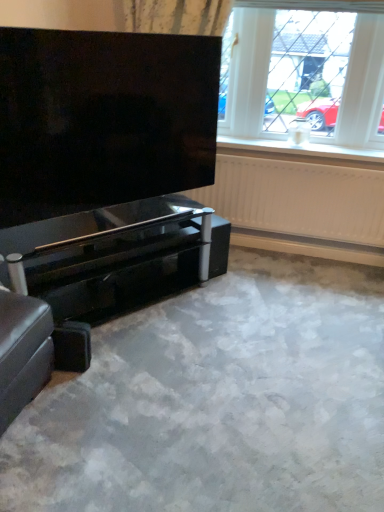
Question: Is glossy black piano at lower left situated inside satin fabric curtain at upper center or outside?

Choices:
 (A) outside
 (B) inside

Answer: (A)

Question: From the image's perspective, relative to satin fabric curtain at upper center, is glossy black piano at lower left above or below?

Choices:
 (A) above
 (B) below

Answer: (B)

Question: Which object is the farthest from the white textured radiator at upper right?

Choices:
 (A) leather ottoman at lower left
 (B) black glossy screen at upper left
 (C) white plastic window sill at upper center
 (D) satin fabric curtain at upper center
 (E) glossy black piano at lower left

Answer: (A)

Question: Which object is positioned closest to the white plastic window sill at upper center?

Choices:
 (A) black glossy screen at upper left
 (B) white textured radiator at upper right
 (C) leather ottoman at lower left
 (D) satin fabric curtain at upper center
 (E) white plastic window at upper center

Answer: (B)